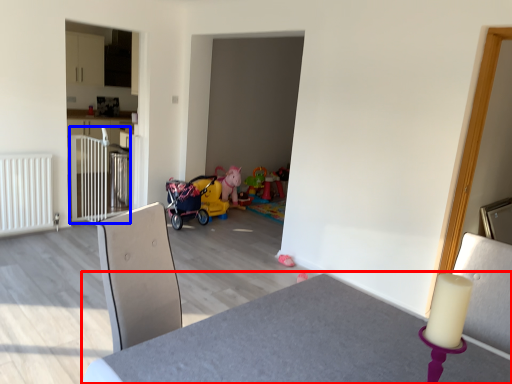
Question: Which point is closer to the camera, table (highlighted by a red box) or rail (highlighted by a blue box)?

Choices:
 (A) table
 (B) rail

Answer: (A)